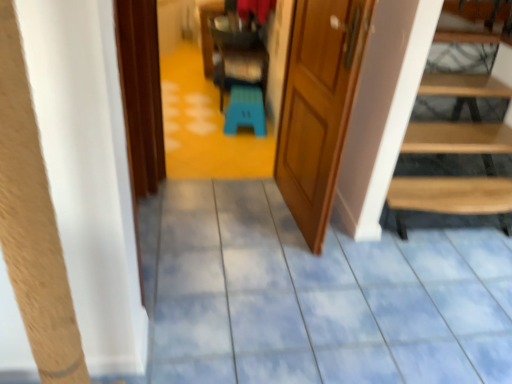
Question: From a real-world perspective, does blue glossy tile floor at center sit lower than wooden door at center?

Choices:
 (A) no
 (B) yes

Answer: (B)

Question: Are blue glossy tile floor at center and wooden door at center beside each other?

Choices:
 (A) no
 (B) yes

Answer: (A)

Question: From the image's perspective, is blue glossy tile floor at center beneath wooden door at center?

Choices:
 (A) no
 (B) yes

Answer: (B)

Question: Is blue glossy tile floor at center surrounding wooden door at center?

Choices:
 (A) yes
 (B) no

Answer: (B)

Question: Is the position of blue glossy tile floor at center more distant than that of wooden door at center?

Choices:
 (A) yes
 (B) no

Answer: (B)

Question: Considering the positions of point (289, 36) and point (231, 132), is point (289, 36) closer or farther from the camera than point (231, 132)?

Choices:
 (A) farther
 (B) closer

Answer: (B)

Question: Considering the positions of wooden door at center and blue plastic stool at center in the image, is wooden door at center bigger or smaller than blue plastic stool at center?

Choices:
 (A) small
 (B) big

Answer: (B)

Question: Visually, is wooden door at center positioned to the left or to the right of blue plastic stool at center?

Choices:
 (A) left
 (B) right

Answer: (B)

Question: Is wooden door at center taller or shorter than blue plastic stool at center?

Choices:
 (A) short
 (B) tall

Answer: (B)

Question: Is wooden door at center to the left or to the right of blue glossy tile floor at center in the image?

Choices:
 (A) right
 (B) left

Answer: (B)

Question: Is wooden door at center in front of or behind blue glossy tile floor at center in the image?

Choices:
 (A) front
 (B) behind

Answer: (B)

Question: Is wooden door at center situated inside blue glossy tile floor at center or outside?

Choices:
 (A) outside
 (B) inside

Answer: (A)

Question: In terms of width, does wooden door at center look wider or thinner when compared to blue glossy tile floor at center?

Choices:
 (A) thin
 (B) wide

Answer: (A)

Question: Relative to blue glossy tile floor at center, is blue plastic stool at center in front or behind?

Choices:
 (A) front
 (B) behind

Answer: (B)

Question: From the image's perspective, is blue plastic stool at center positioned above or below blue glossy tile floor at center?

Choices:
 (A) below
 (B) above

Answer: (B)